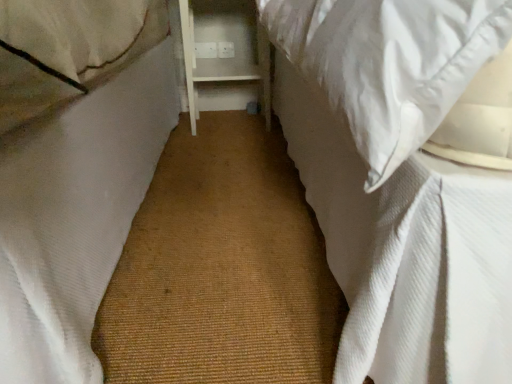
I want to click on vacant area situated below white wood shelf at center (from a real-world perspective), so click(230, 122).